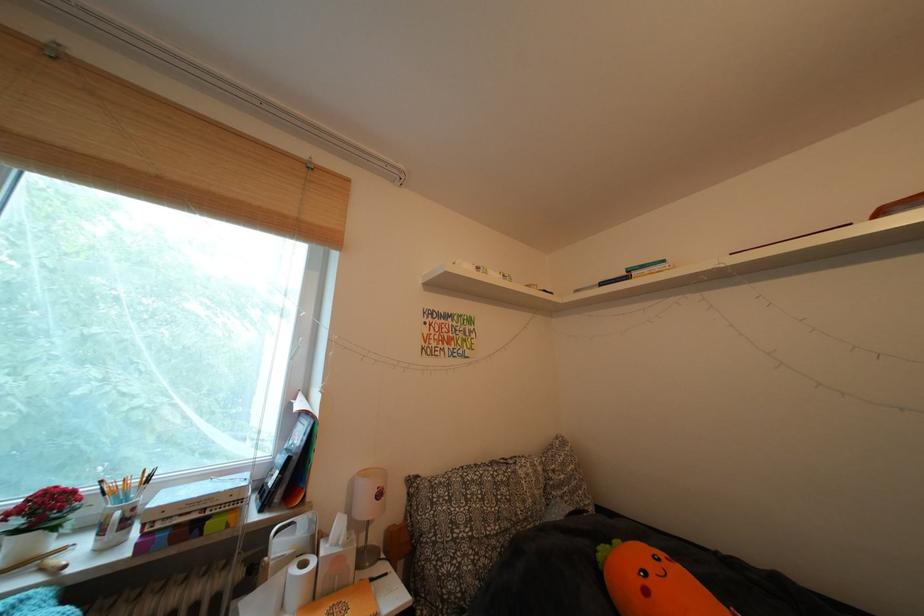
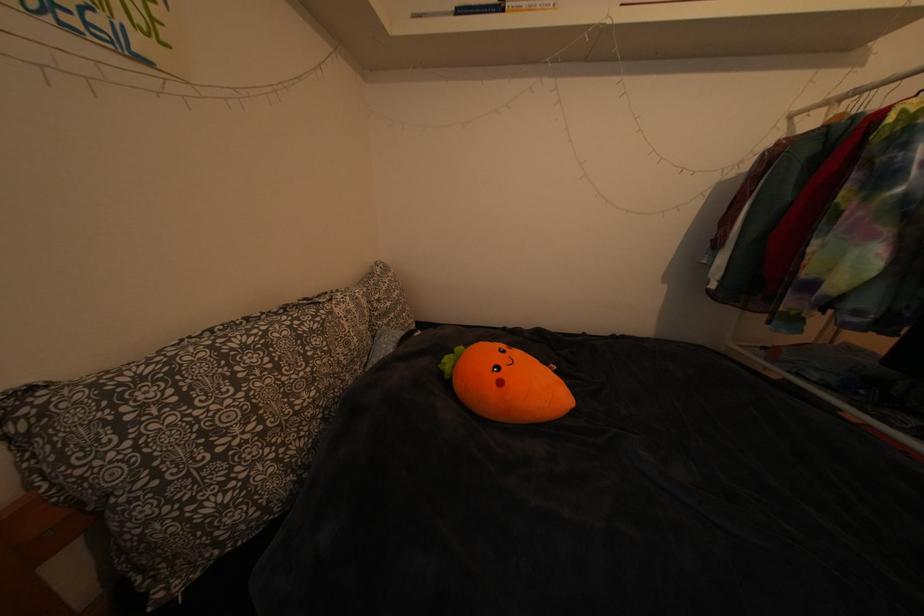
Based on the continuous images, in which direction is the camera rotating?

The camera rotated toward right-down.